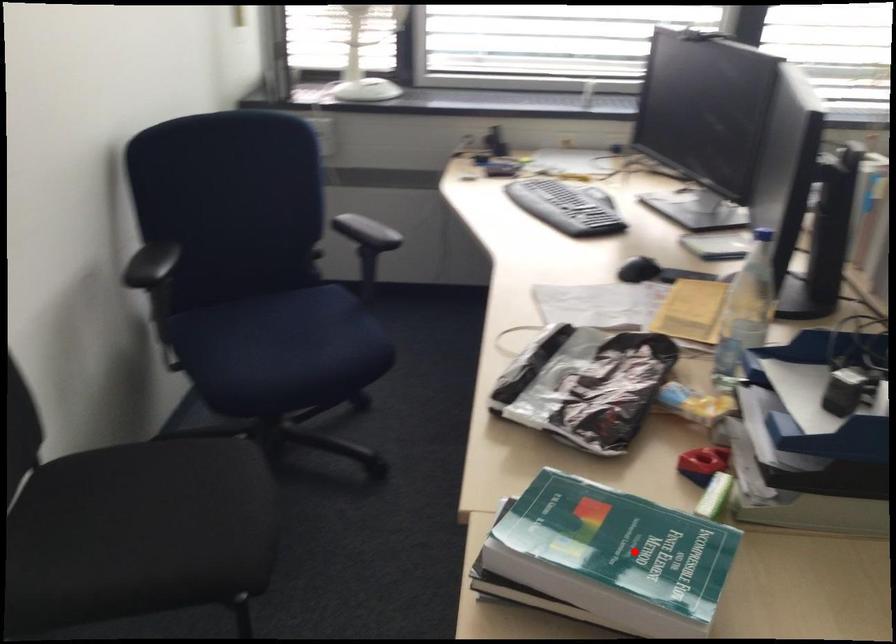
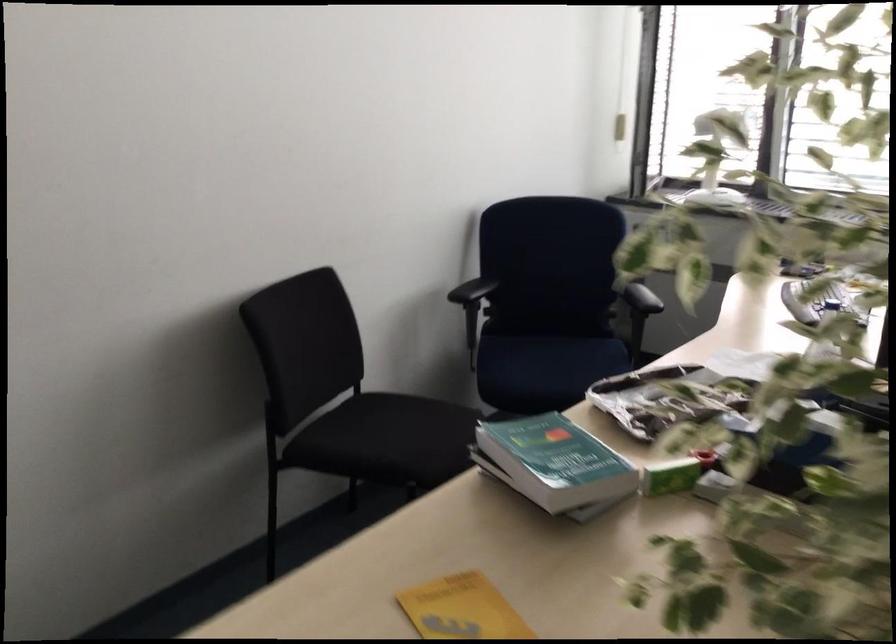
The point at the highlighted location is marked in the first image. Where is the corresponding point in the second image?

(554, 462)